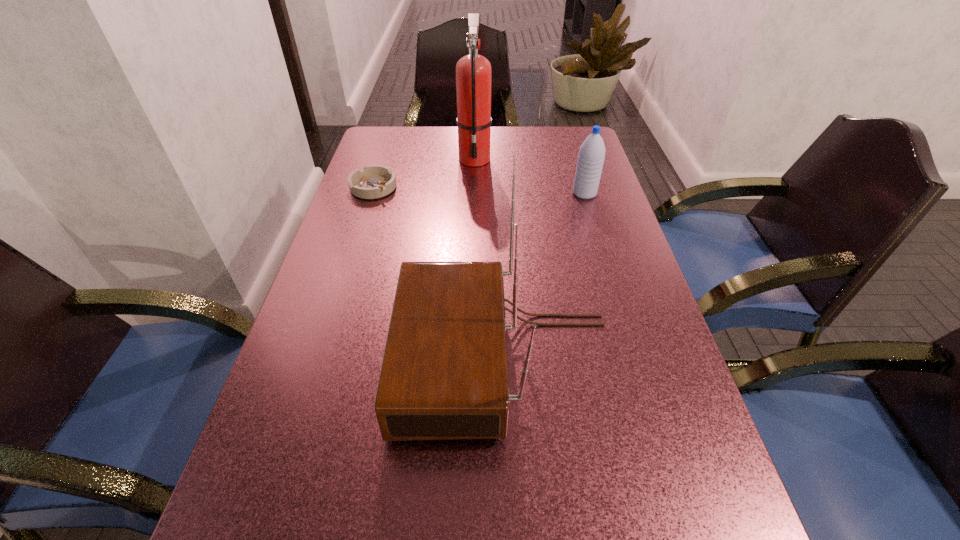
Find the location of `the tallest object`. the tallest object is located at coordinates (473, 72).

Locate an element on the screen. fire extinguisher is located at coordinates (473, 72).

Find the location of a particular element. The width and height of the screenshot is (960, 540). radio_receiver is located at coordinates (444, 376).

Where is `the nearest object`? Image resolution: width=960 pixels, height=540 pixels. the nearest object is located at coordinates (444, 376).

Find the location of a particular element. water bottle is located at coordinates (591, 156).

In order to click on the rightmost object in this screenshot , I will do `click(591, 156)`.

I want to click on ashtray, so point(375,181).

Find the location of a particular element. This screenshot has width=960, height=540. the shortest object is located at coordinates (375, 181).

The image size is (960, 540). What are the coordinates of `vacant space positioned on the hose direction of the tallest object` in the screenshot? It's located at (473, 221).

Identify the location of free space located on the front panel of the radio_receiver. The width and height of the screenshot is (960, 540). (372, 357).